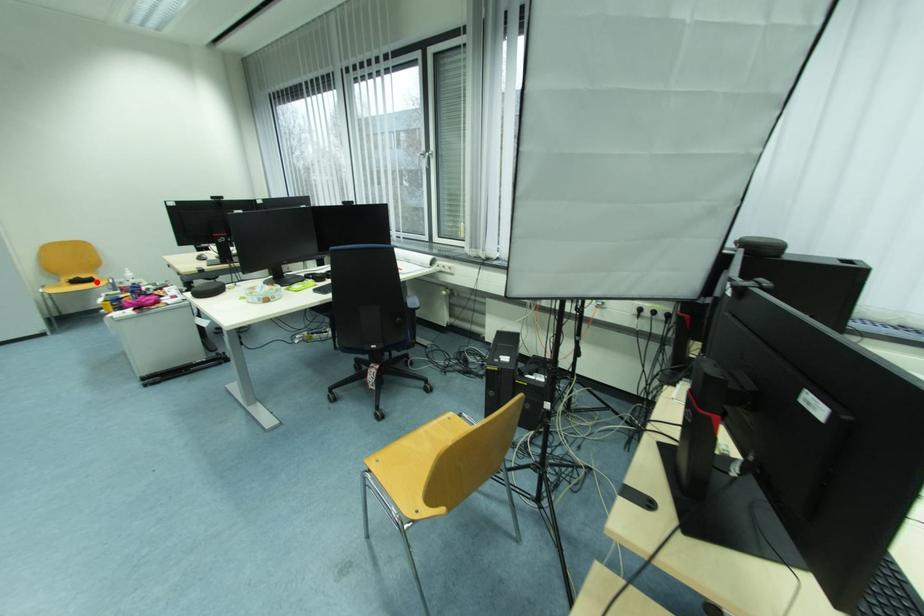
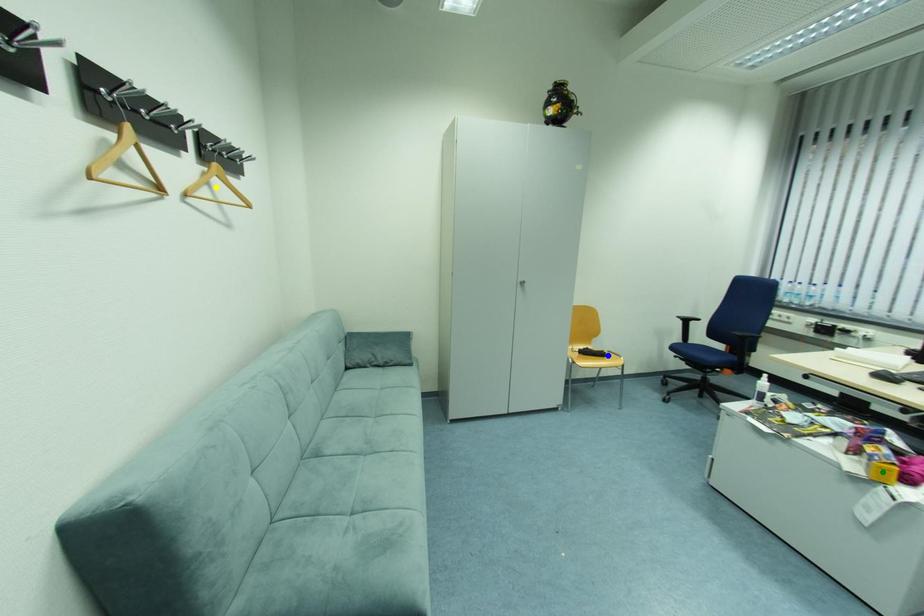
Question: I am providing you with two images of the same scene from different viewpoints. A red point is marked on the first image. You are given multiple points on the second image. Can you choose the point in image 2 that corresponds to the point in image 1?

Choices:
 (A) blue point
 (B) green point
 (C) yellow point

Answer: (A)